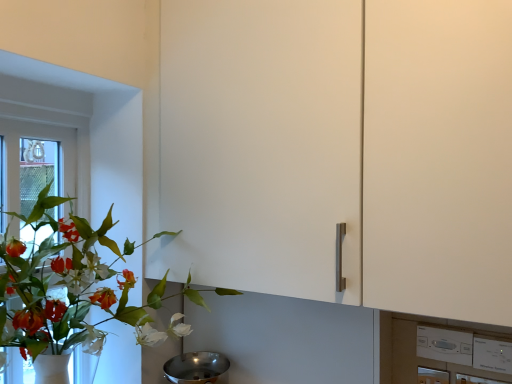
Describe the element at coordinates (48, 161) in the screenshot. This screenshot has width=512, height=384. I see `white plastic window frame at left` at that location.

Describe the element at coordinates (492, 355) in the screenshot. I see `white plastic switch at lower right` at that location.

Find the location of a particular element. polished stainless steel mixing bowl at lower center is located at coordinates (197, 368).

Locate an element on the screen. This screenshot has height=384, width=512. white plastic window frame at left is located at coordinates (48, 161).

Where is `houseplant below the white plastic window frame at left (from the image's perspective)`? This screenshot has width=512, height=384. houseplant below the white plastic window frame at left (from the image's perspective) is located at coordinates (71, 288).

From the image's perspective, relative to white plastic window frame at left, is green matte plant at left above or below?

Based on their image positions, green matte plant at left is located beneath white plastic window frame at left.

Is green matte plant at left looking in the opposite direction of white plastic window frame at left?

Yes, white plastic window frame at left is at the back of green matte plant at left.

Considering the positions of objects white plastic window frame at left and white plastic switch at lower right in the image provided, who is behind, white plastic window frame at left or white plastic switch at lower right?

white plastic window frame at left is behind.

In terms of size, does white plastic window frame at left appear bigger or smaller than white plastic switch at lower right?

Considering their sizes, white plastic window frame at left takes up more space than white plastic switch at lower right.

Which of these two, white plastic window frame at left or white plastic switch at lower right, stands shorter?

Standing shorter between the two is white plastic switch at lower right.

Does white plastic window frame at left have a lesser width compared to white plastic switch at lower right?

No.

From the image's perspective, between white plastic window frame at left and polished stainless steel mixing bowl at lower center, who is located below?

From the image's view, polished stainless steel mixing bowl at lower center is below.

The image size is (512, 384). In order to click on window frame that is above the polished stainless steel mixing bowl at lower center (from a real-world perspective) in this screenshot , I will do `click(48, 161)`.

Are white plastic window frame at left and polished stainless steel mixing bowl at lower center making contact?

white plastic window frame at left and polished stainless steel mixing bowl at lower center are clearly separated.

From the image's perspective, is green matte plant at left on white plastic switch at lower right?

Yes.

Looking at their sizes, would you say green matte plant at left is wider or thinner than white plastic switch at lower right?

In the image, green matte plant at left appears to be wider than white plastic switch at lower right.

Which object is more forward, green matte plant at left or white plastic switch at lower right?

green matte plant at left.

Identify the location of houseplant above the polished stainless steel mixing bowl at lower center (from a real-world perspective). The image size is (512, 384). (71, 288).

Would you say green matte plant at left is to the left or to the right of polished stainless steel mixing bowl at lower center in the picture?

From the image, it's evident that green matte plant at left is to the left of polished stainless steel mixing bowl at lower center.

Which object is closer to the camera, green matte plant at left or polished stainless steel mixing bowl at lower center?

green matte plant at left is more forward.

Which is correct: green matte plant at left is inside polished stainless steel mixing bowl at lower center, or outside of it?

green matte plant at left exists outside the volume of polished stainless steel mixing bowl at lower center.

Looking at their sizes, would you say white plastic switch at lower right is wider or thinner than green matte plant at left?

white plastic switch at lower right is thinner than green matte plant at left.

Could you tell me if white plastic switch at lower right is turned towards green matte plant at left?

No, white plastic switch at lower right is not turned towards green matte plant at left.

Find the location of a particular element. appliance below the green matte plant at left (from the image's perspective) is located at coordinates (492, 355).

Does point (501, 371) appear closer or farther from the camera than point (1, 315)?

Point (501, 371) appears to be farther away from the viewer than point (1, 315).

From a real-world perspective, between white plastic switch at lower right and polished stainless steel mixing bowl at lower center, who is vertically higher?

white plastic switch at lower right.

Between white plastic switch at lower right and polished stainless steel mixing bowl at lower center, which one has smaller width?

white plastic switch at lower right is thinner.

Is white plastic switch at lower right looking in the opposite direction of polished stainless steel mixing bowl at lower center?

white plastic switch at lower right does not have its back to polished stainless steel mixing bowl at lower center.

Is white plastic switch at lower right in front of or behind polished stainless steel mixing bowl at lower center in the image?

white plastic switch at lower right is in front of polished stainless steel mixing bowl at lower center.

Where is `houseplant on the right of white plastic window frame at left`? houseplant on the right of white plastic window frame at left is located at coordinates (71, 288).

This screenshot has height=384, width=512. I want to click on window frame located above the white plastic switch at lower right (from a real-world perspective), so click(x=48, y=161).

Looking at the image, which one is located closer to white plastic switch at lower right, green matte plant at left or polished stainless steel mixing bowl at lower center?

The object closer to white plastic switch at lower right is polished stainless steel mixing bowl at lower center.

When comparing their distances from green matte plant at left, does white plastic window frame at left or polished stainless steel mixing bowl at lower center seem further?

The object further to green matte plant at left is polished stainless steel mixing bowl at lower center.

Based on their spatial positions, is polished stainless steel mixing bowl at lower center or green matte plant at left closer to white plastic switch at lower right?

polished stainless steel mixing bowl at lower center is positioned closer to the anchor white plastic switch at lower right.

From the picture: Estimate the real-world distances between objects in this image. Which object is further from white plastic window frame at left, polished stainless steel mixing bowl at lower center or white plastic switch at lower right?

Based on the image, white plastic switch at lower right appears to be further to white plastic window frame at left.

When comparing their distances from white plastic switch at lower right, does polished stainless steel mixing bowl at lower center or white plastic window frame at left seem closer?

The object closer to white plastic switch at lower right is polished stainless steel mixing bowl at lower center.

Based on the photo, looking at the image, which one is located closer to white plastic switch at lower right, white plastic window frame at left or polished stainless steel mixing bowl at lower center?

Among the two, polished stainless steel mixing bowl at lower center is located nearer to white plastic switch at lower right.

When comparing their distances from white plastic window frame at left, does white plastic switch at lower right or polished stainless steel mixing bowl at lower center seem further?

white plastic switch at lower right lies further to white plastic window frame at left than the other object.

Considering their positions, is white plastic switch at lower right positioned closer to green matte plant at left than white plastic window frame at left?

white plastic window frame at left lies closer to green matte plant at left than the other object.

This screenshot has width=512, height=384. Identify the location of mixing bowl situated between white plastic window frame at left and white plastic switch at lower right from left to right. (197, 368).

Image resolution: width=512 pixels, height=384 pixels. What are the coordinates of `mixing bowl between green matte plant at left and white plastic switch at lower right from left to right` in the screenshot? It's located at (197, 368).

Where is `mixing bowl between green matte plant at left and white plastic window frame at left from front to back`? The width and height of the screenshot is (512, 384). mixing bowl between green matte plant at left and white plastic window frame at left from front to back is located at coordinates (197, 368).

Image resolution: width=512 pixels, height=384 pixels. Find the location of `houseplant located between white plastic window frame at left and white plastic switch at lower right in the left-right direction`. houseplant located between white plastic window frame at left and white plastic switch at lower right in the left-right direction is located at coordinates (71, 288).